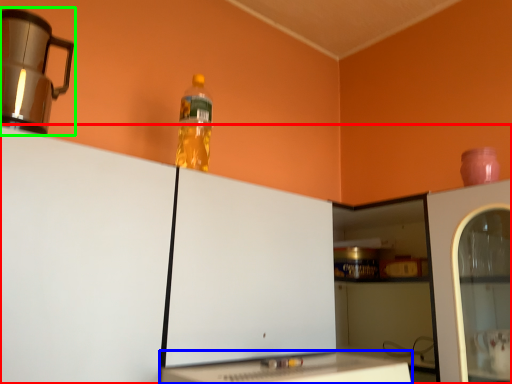
Question: Which object is positioned farthest from cabinetry (highlighted by a red box)? Select from table (highlighted by a blue box) and home appliance (highlighted by a green box).

Choices:
 (A) table
 (B) home appliance

Answer: (B)